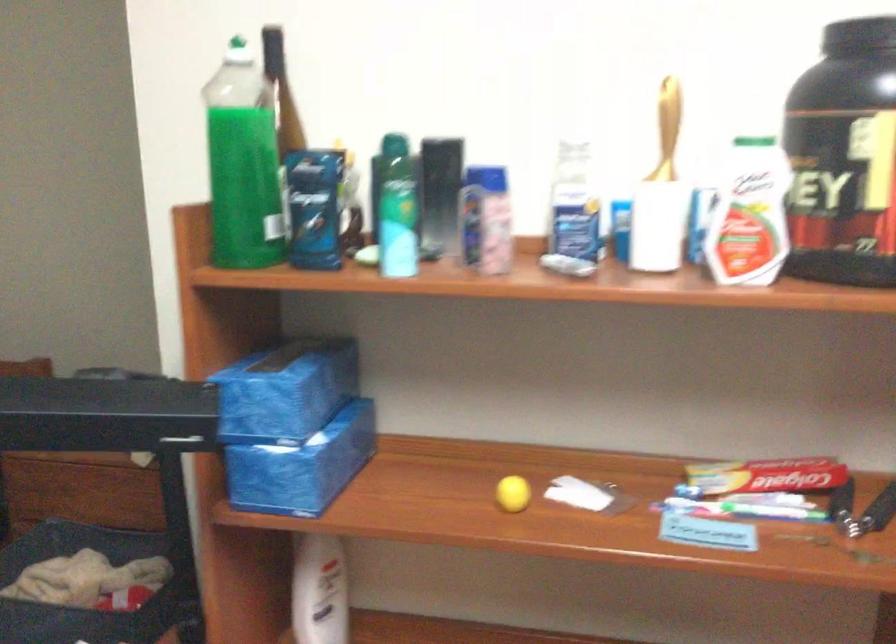
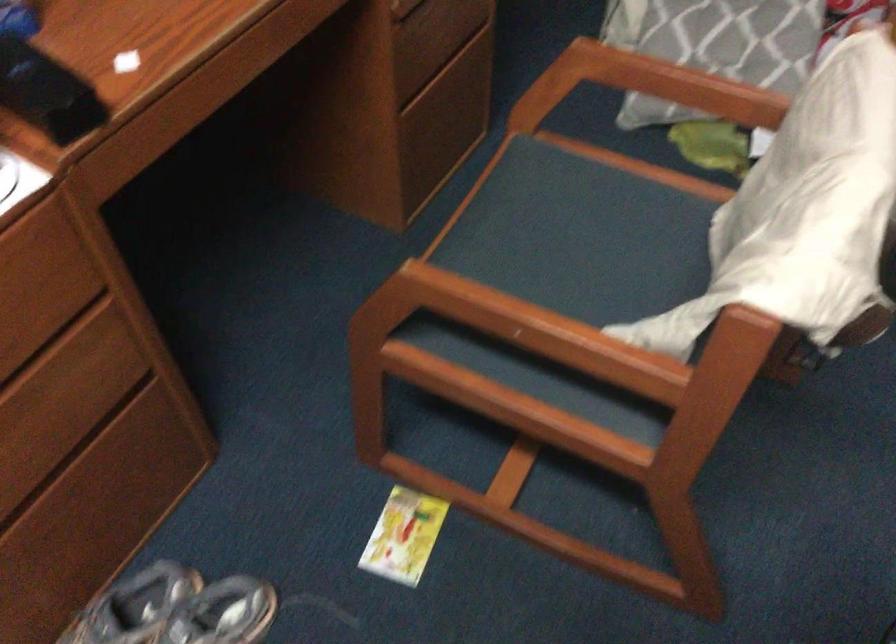
First-person continuous shooting, in which direction is the camera rotating?

The rotation direction of the camera is left-down.